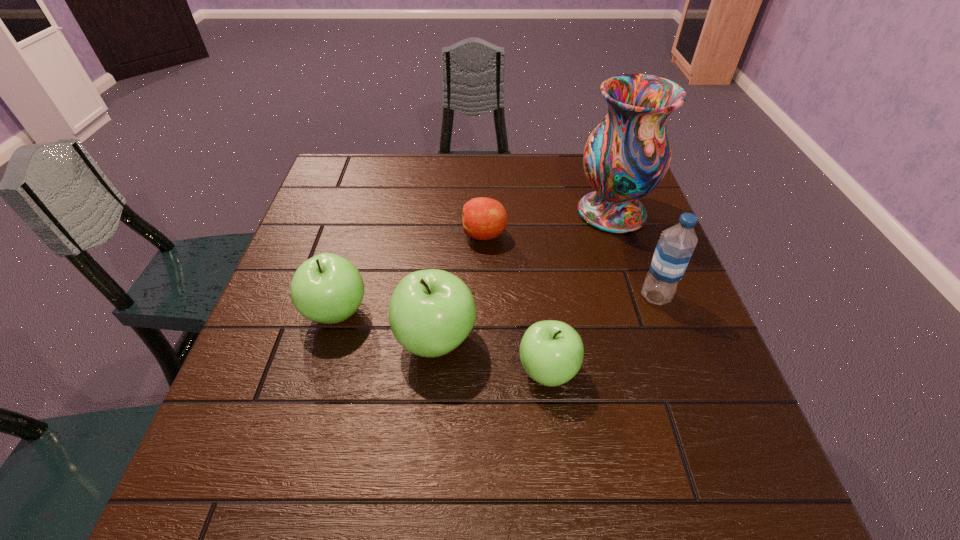
You are a GUI agent. You are given a task and a screenshot of the screen. Output one action in this format:
    pyautogui.click(x=<x>, y=<y>)
    Task: Click on the apple that stands as the closest to the fifth shortest object
    The width and height of the screenshot is (960, 540).
    Given the screenshot: What is the action you would take?
    pyautogui.click(x=551, y=352)

I want to click on apple that is the third closest one to the vase, so click(431, 312).

Locate an element on the screen. This screenshot has height=540, width=960. free region that satisfies the following two spatial constraints: 1. on the back side of the tallest object; 2. on the left side of the third shortest object is located at coordinates (366, 212).